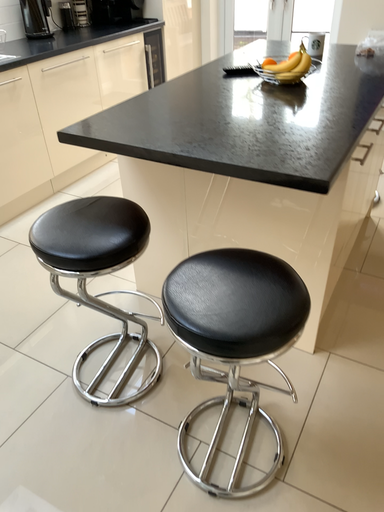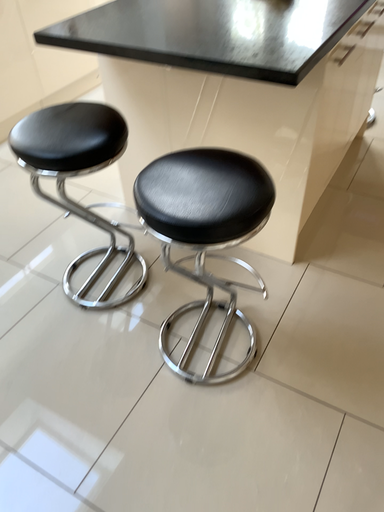
Question: Which way did the camera rotate in the video?

Choices:
 (A) rotated downward
 (B) rotated upward

Answer: (A)